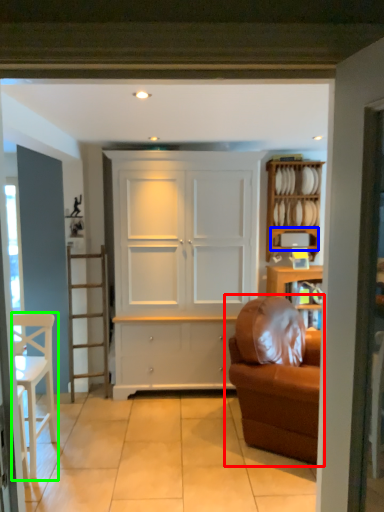
Question: Considering the real-world distances, which object is closest to studio couch (highlighted by a red box)? shelf (highlighted by a blue box) or chair (highlighted by a green box).

Choices:
 (A) shelf
 (B) chair

Answer: (A)